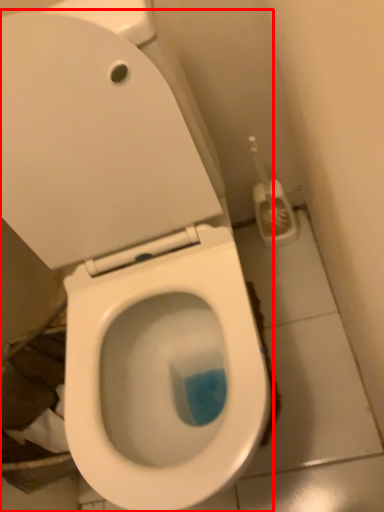
Question: Where is toilet (annotated by the red box) located in relation to brush in the image?

Choices:
 (A) left
 (B) right

Answer: (A)